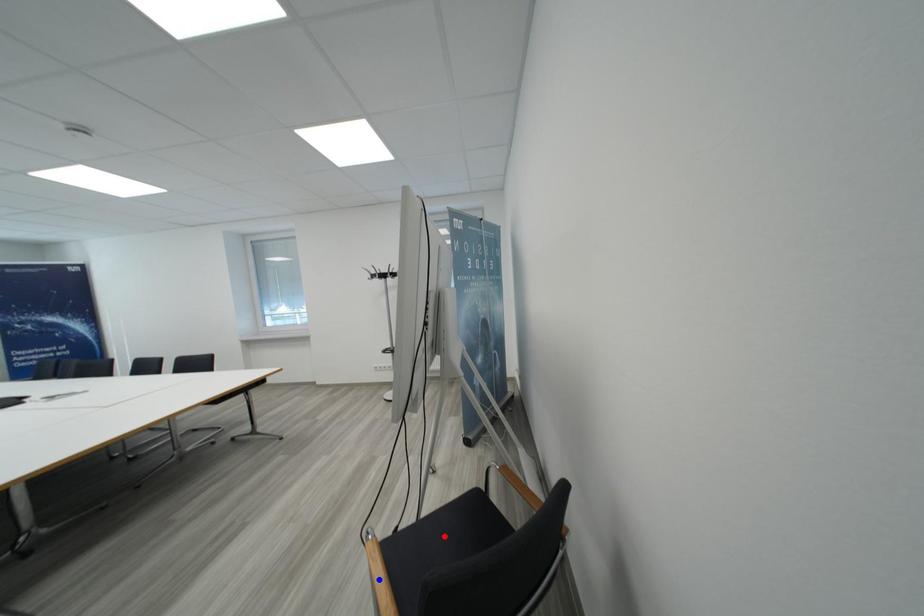
Question: In the image, two points are highlighted. Which point is nearer to the camera? Reply with the corresponding letter.

Choices:
 (A) blue point
 (B) red point

Answer: (A)